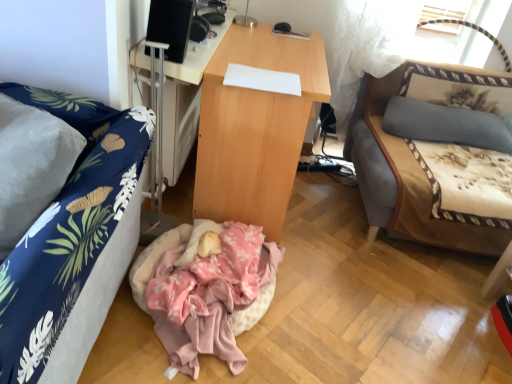
Where is `spots to the right of pink fabric infant bed at center`? spots to the right of pink fabric infant bed at center is located at coordinates (334, 331).